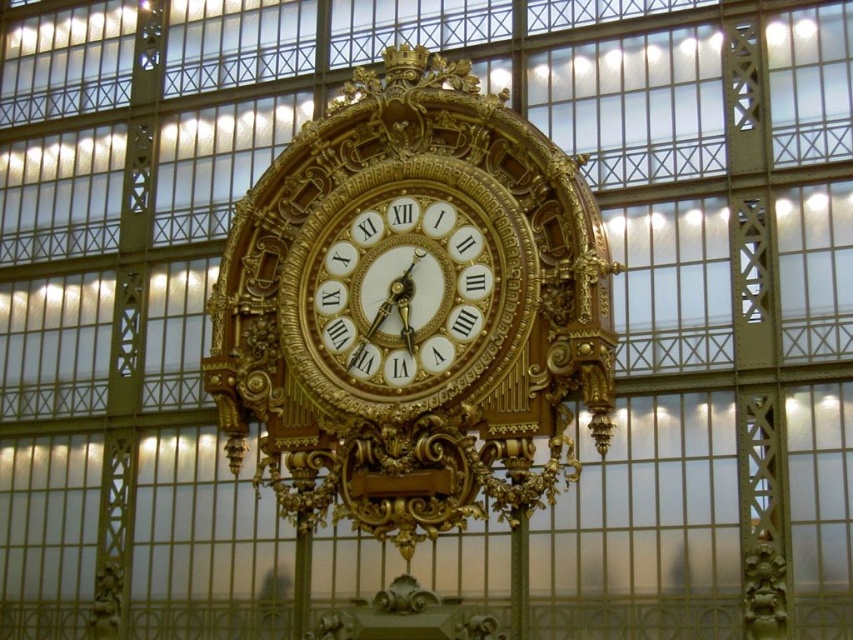
Does gold ornate clock at center have a smaller size compared to gold metallic clock at center?

Actually, gold ornate clock at center might be larger than gold metallic clock at center.

Is point (483, 148) positioned behind point (334, 291)?

No, (483, 148) is closer to viewer.

Does point (544, 404) come farther from viewer compared to point (471, 288)?

No, (544, 404) is in front of (471, 288).

Identify the location of gold ornate clock at center. This screenshot has height=640, width=853. (412, 307).